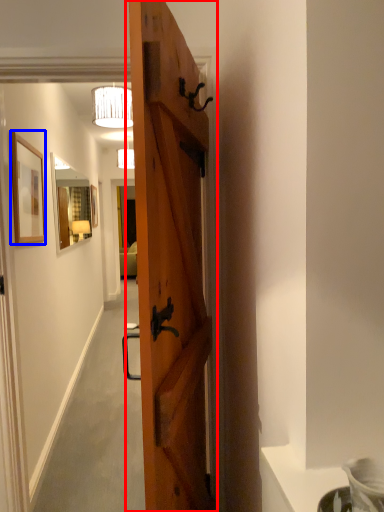
Question: Which object appears closest to the camera in this image, door (highlighted by a red box) or picture frame (highlighted by a blue box)?

Choices:
 (A) door
 (B) picture frame

Answer: (A)